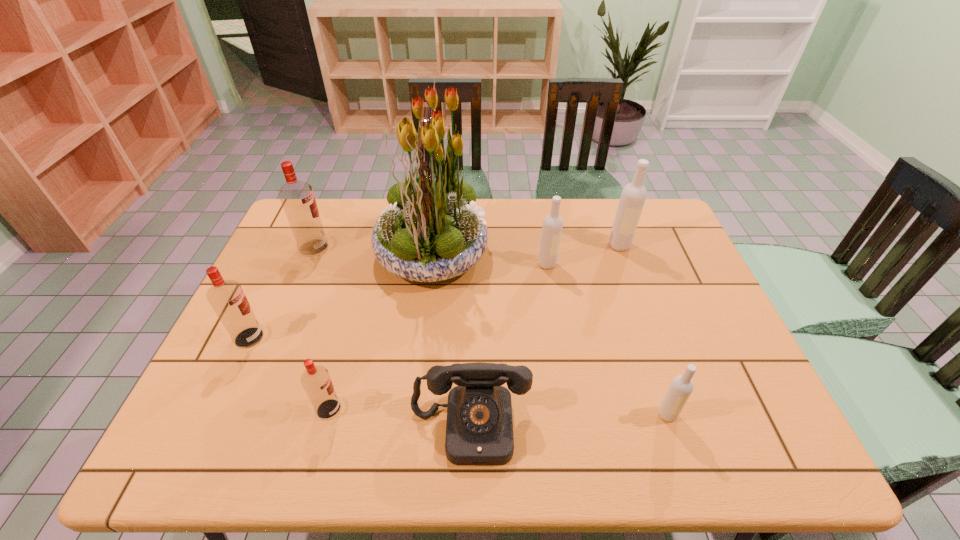
Locate an element on the screen. object at the near edge is located at coordinates (479, 430).

The width and height of the screenshot is (960, 540). Identify the location of object situated at the far left corner. (297, 198).

You are a GUI agent. You are given a task and a screenshot of the screen. Output one action in this format:
    pyautogui.click(x=<x>, y=<y>)
    Task: Click on the vacant space at the far edge
    The width and height of the screenshot is (960, 540).
    Given the screenshot: What is the action you would take?
    pyautogui.click(x=366, y=214)

Locate an element on the screen. The image size is (960, 540). vacant space at the left edge of the desktop is located at coordinates (255, 309).

In order to click on vacant space at the right edge of the desktop in this screenshot , I will do `click(728, 399)`.

Identify the location of vacant region at the far right corner of the desktop. (662, 210).

Image resolution: width=960 pixels, height=540 pixels. What are the coordinates of `free space between the nearest white vodka and the biggest white vodka` in the screenshot? It's located at (643, 330).

You are a GUI agent. You are given a task and a screenshot of the screen. Output one action in this format:
    pyautogui.click(x=<x>, y=<y>)
    Task: Click on the vacant area that lies between the leftmost white vodka and the farthest white vodka
    The width and height of the screenshot is (960, 540).
    Given the screenshot: What is the action you would take?
    pyautogui.click(x=584, y=255)

You are a GUI agent. You are given a task and a screenshot of the screen. Output one action in this format:
    pyautogui.click(x=<x>, y=<y>)
    Task: Click on the free space between the tallest object and the second biggest white vodka
    
    Given the screenshot: What is the action you would take?
    pyautogui.click(x=490, y=258)

The width and height of the screenshot is (960, 540). Find the location of `vacant region between the biggest white vodka and the third farthest vodka`. vacant region between the biggest white vodka and the third farthest vodka is located at coordinates (584, 255).